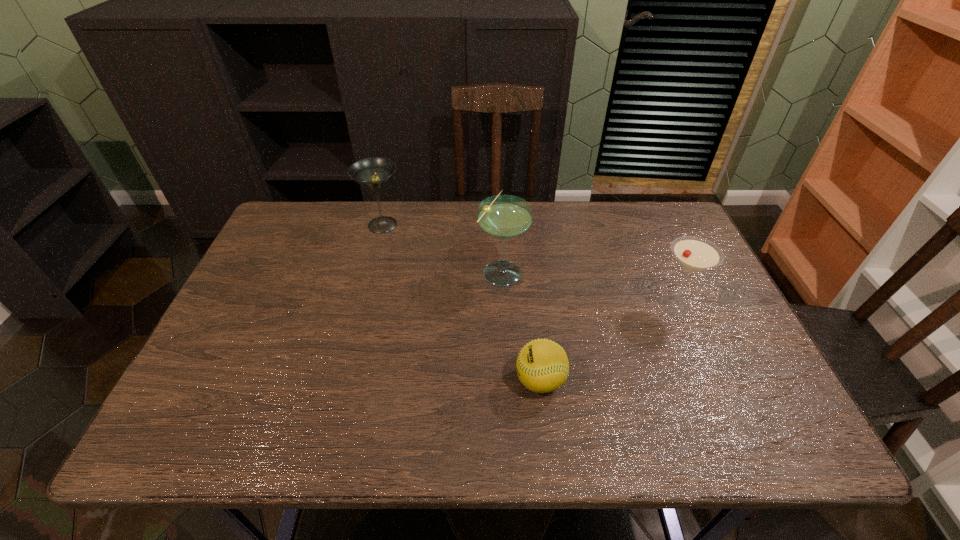
Identify the location of blank space located on the logo side of the softball. (444, 381).

The width and height of the screenshot is (960, 540). What are the coordinates of `vacant position located on the logo side of the softball` in the screenshot? It's located at pyautogui.click(x=377, y=381).

The image size is (960, 540). I want to click on vacant region located on the logo side of the softball, so click(444, 381).

At what (x,y) coordinates should I click in order to perform the action: click on object that is at the far edge. Please return your answer as a coordinate pair (x, y). The image size is (960, 540). Looking at the image, I should click on (373, 173).

At what (x,y) coordinates should I click in order to perform the action: click on object present at the right edge. Please return your answer as a coordinate pair (x, y). Looking at the image, I should click on (694, 254).

Where is `vacant space at the far edge of the desktop`? Image resolution: width=960 pixels, height=540 pixels. vacant space at the far edge of the desktop is located at coordinates (625, 232).

The image size is (960, 540). I want to click on vacant position at the near edge of the desktop, so click(550, 416).

I want to click on blank space at the left edge of the desktop, so click(250, 325).

The height and width of the screenshot is (540, 960). In order to click on vacant space at the far left corner of the desktop in this screenshot , I will do `click(324, 226)`.

In order to click on blank space at the far right corner of the desktop in this screenshot , I will do `click(651, 203)`.